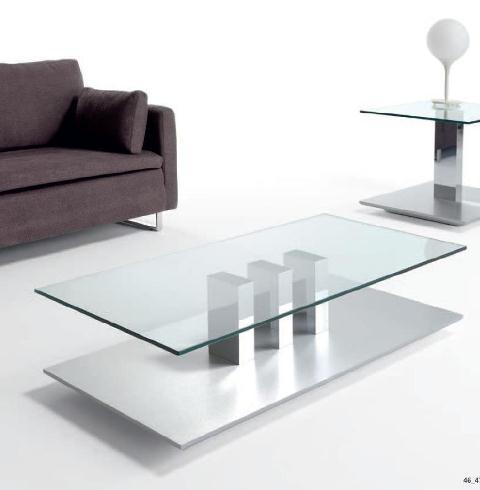
At what (x,y) coordinates should I click in order to perform the action: click on couch. Please return your answer as a coordinate pair (x, y). The width and height of the screenshot is (480, 490). Looking at the image, I should click on (81, 165).